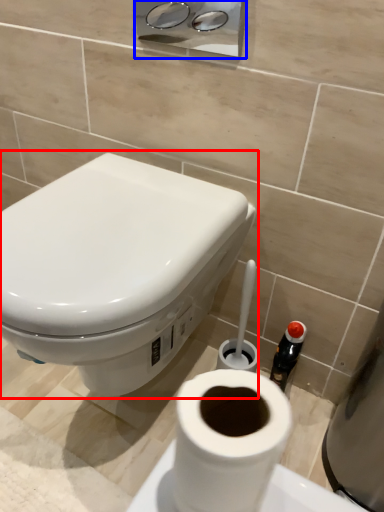
Question: Which object is closer to the camera taking this photo, toilet (highlighted by a red box) or dispenser (highlighted by a blue box)?

Choices:
 (A) toilet
 (B) dispenser

Answer: (A)